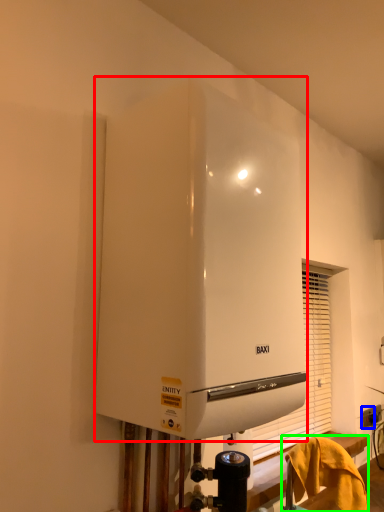
Question: Which object is the farthest from home appliance (highlighted by a red box)? Choose among these: electric outlet (highlighted by a blue box) or furniture (highlighted by a green box).

Choices:
 (A) electric outlet
 (B) furniture

Answer: (A)